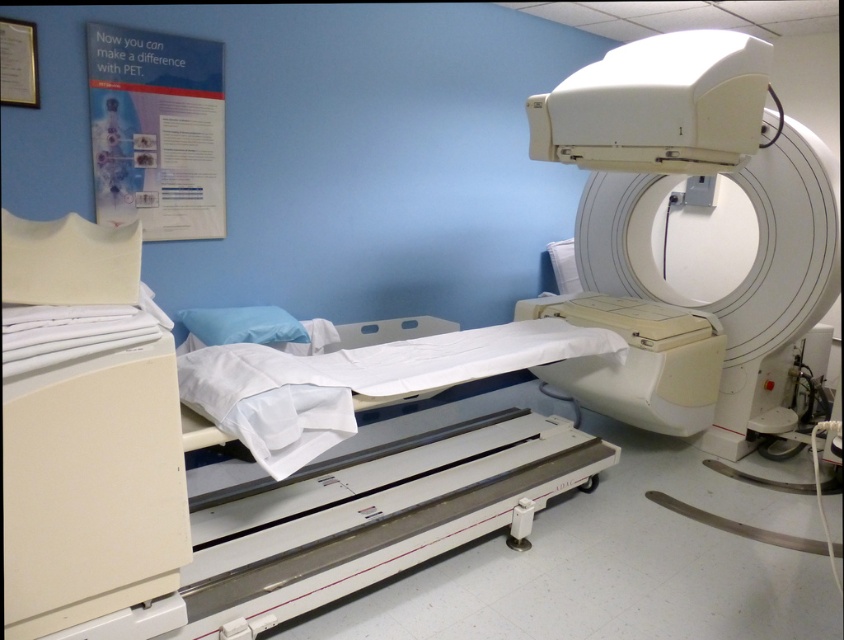
You are a patient preparing for a PET scan and need to place your personal items on the bed. The bed has limited space. Which item, the white paper at upper left or the blue fabric pillow at center, can you place without taking up too much space?

The white paper at upper left can be placed without taking up too much space because it is thinner than the blue fabric pillow at center.

You are a technician in the medical imaging room. You need to place a white paper at upper left on a shelf that is exactly 2 meters away from the camera. Can you reach it without moving the paper?

The white paper at upper left is 2.36 meters away from the camera, which is further than the shelf at 2 meters. Therefore, you cannot reach the shelf from the current position of the white paper at upper left without moving it.